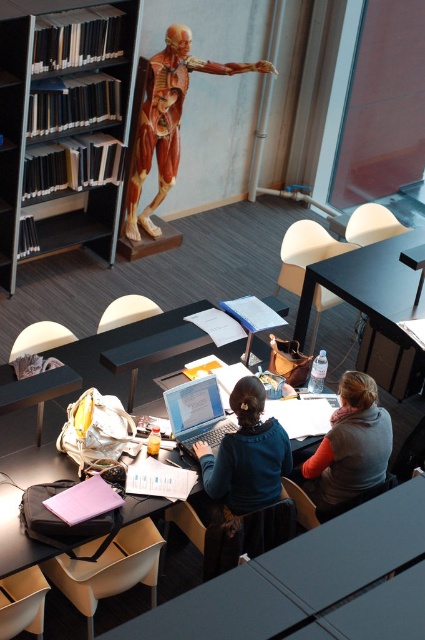
Does smooth flesh-colored anatomical model at upper center have a lesser height compared to silver metallic laptop at center?

No, smooth flesh-colored anatomical model at upper center is not shorter than silver metallic laptop at center.

Is point (172, 44) positioned before point (209, 406)?

No, (172, 44) is further to viewer.

Locate an element on the screen. This screenshot has height=640, width=425. smooth flesh-colored anatomical model at upper center is located at coordinates point(167,122).

What do you see at coordinates (62, 129) in the screenshot? I see `black plastic bookcase at left` at bounding box center [62, 129].

I want to click on black plastic bookcase at left, so click(x=62, y=129).

Who is positioned more to the right, gray fleece jacket at center or blue fabric shirt at center?

From the viewer's perspective, gray fleece jacket at center appears more on the right side.

Between point (314, 488) and point (243, 481), which one is positioned behind?

Point (314, 488)

Where is `gray fleece jacket at center`? gray fleece jacket at center is located at coordinates (348, 448).